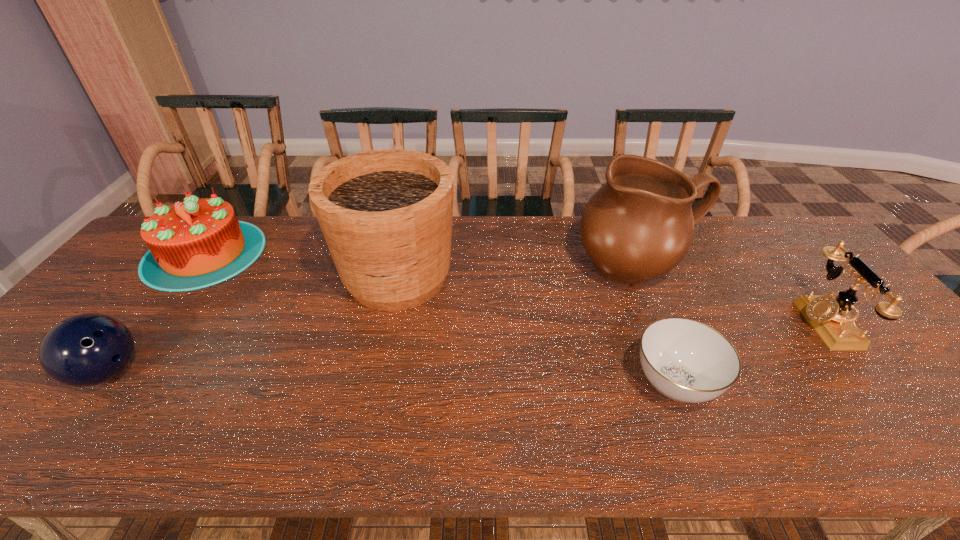
Identify the location of vacant space that satisfies the following two spatial constraints: 1. on the back side of the chinaware; 2. on the surface of the bowling ball near the finger holes. The height and width of the screenshot is (540, 960). (670, 372).